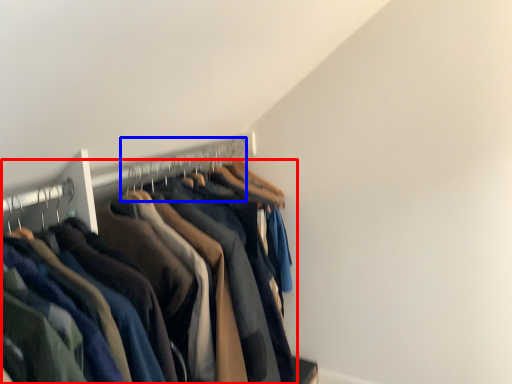
Question: Among these objects, which one is nearest to the camera, trousers (highlighted by a red box) or hanger (highlighted by a blue box)?

Choices:
 (A) trousers
 (B) hanger

Answer: (A)